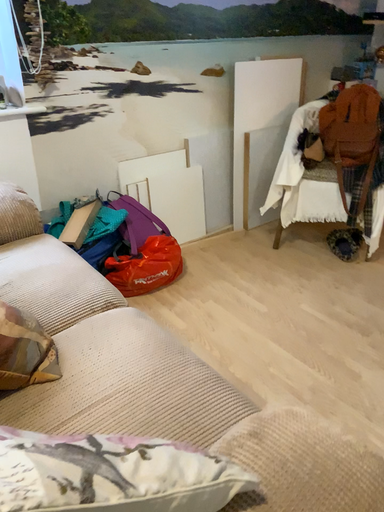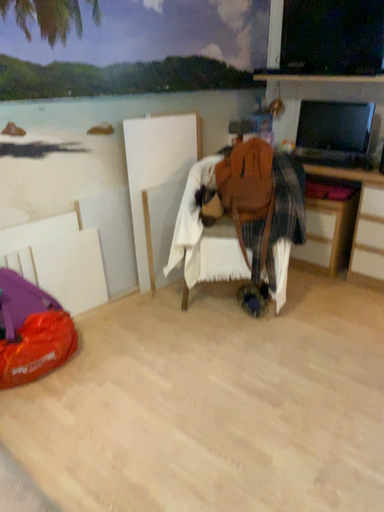
Question: How did the camera likely rotate when shooting the video?

Choices:
 (A) rotated upward
 (B) rotated downward

Answer: (A)